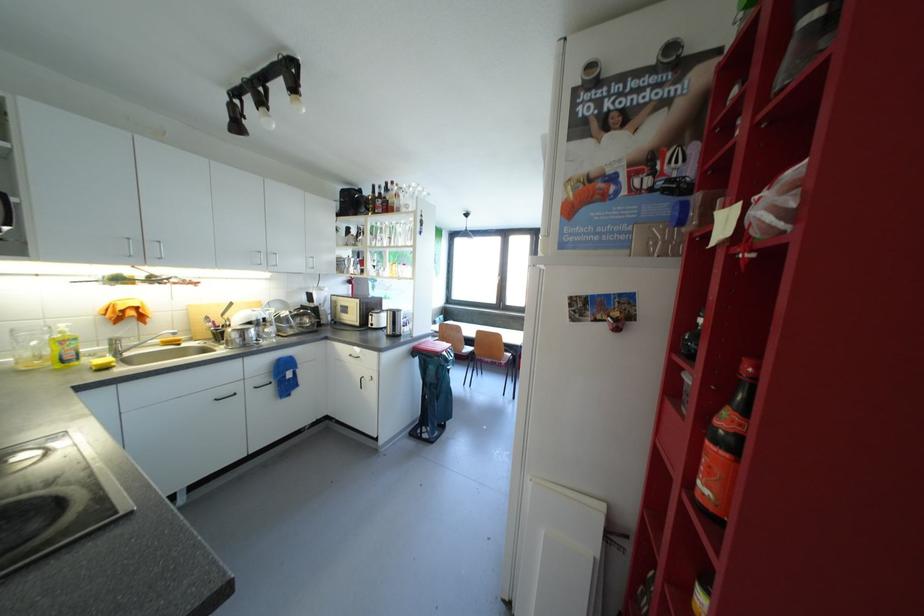
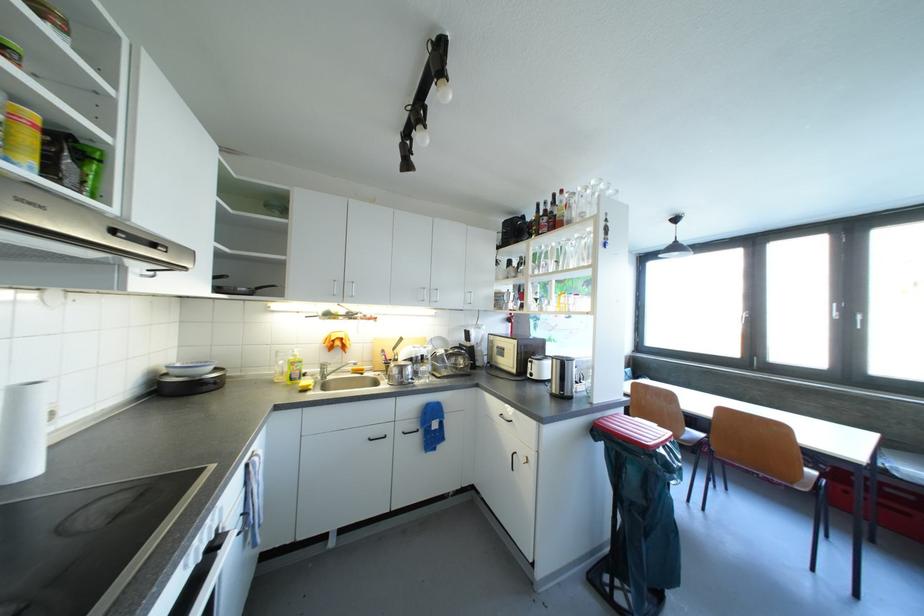
Locate, in the second image, the point that corresponds to pixel 349 353 in the first image.

(500, 408)